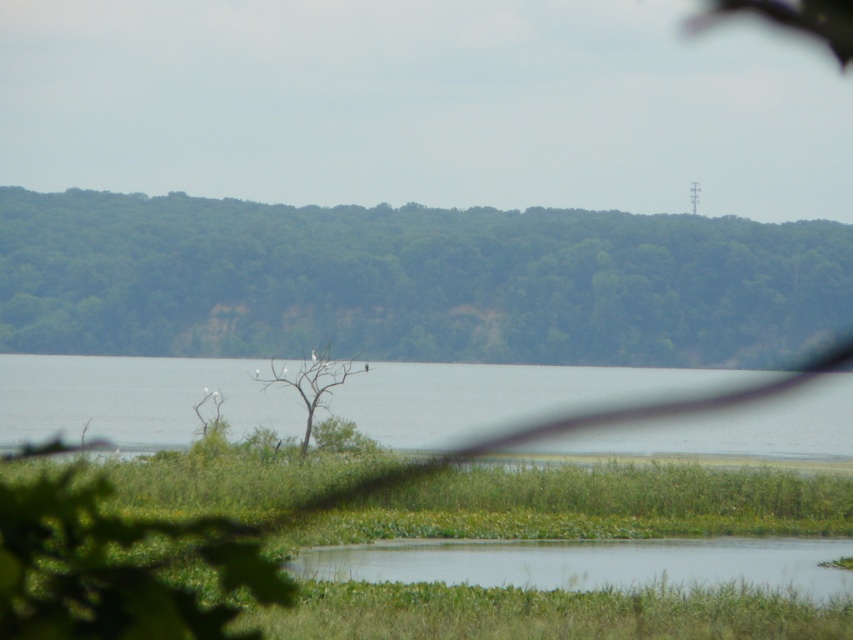
You are standing at the edge of the serene natural landscape looking towards the water. There are two points marked in the image, point 1 at coordinates point (718, 540) and point 2 at coordinates point (322, 394). Which point is closer to you?

Point (718, 540) is closer to the camera than point (322, 394), so the point closer to you is point (718, 540).

You are a bird flying over the serene natural landscape. You see the green leafy tree at upper center and the clear water at lower center. Which object would you choose to land on if you want to rest, and why?

The green leafy tree at upper center has a larger size compared to the clear water at lower center, so it would provide a more stable and comfortable resting spot for the bird.

In the scene shown: You are a kayaker planning to paddle through the clear water at lower center and around the dead wood tree at center. Given the width of the water and the tree, can you safely navigate between them without touching the tree?

The clear water at lower center is wider than the dead wood tree at center, so yes, you can safely navigate between them without touching the tree.